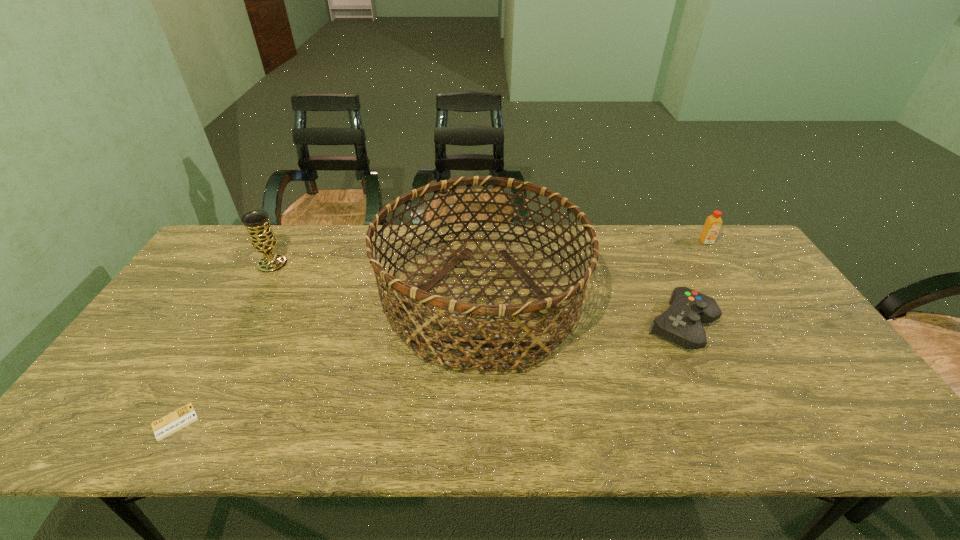
This screenshot has height=540, width=960. Find the location of `empty space between the tallest object and the fourth shortest object`. empty space between the tallest object and the fourth shortest object is located at coordinates (377, 282).

The image size is (960, 540). Find the location of `vacant space in between the fourth tallest object and the tallest object`. vacant space in between the fourth tallest object and the tallest object is located at coordinates (582, 313).

Locate an element on the screen. The height and width of the screenshot is (540, 960). the third closest object to the chalice is located at coordinates (681, 324).

Identify which object is the third closest to the chalice. Please provide its 2D coordinates. Your answer should be formatted as a tuple, i.e. [(x, y)], where the tuple contains the x and y coordinates of a point satisfying the conditions above.

[(681, 324)]

Locate an element on the screen. vacant space that satisfies the following two spatial constraints: 1. on the front side of the second shortest object; 2. on the right side of the chalice is located at coordinates (238, 326).